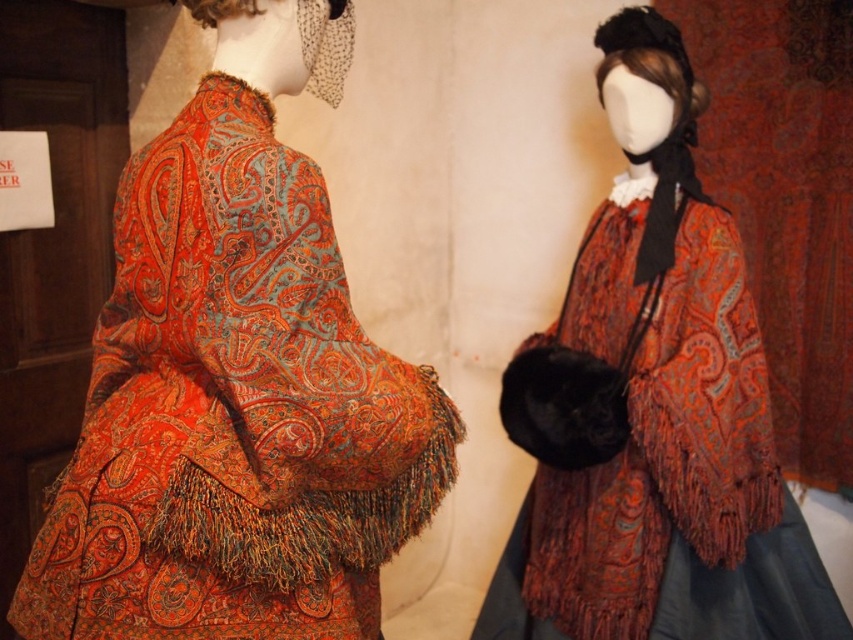
Question: Is paisley-patterned fabric at center below matte paisley cape at center?

Choices:
 (A) yes
 (B) no

Answer: (B)

Question: Can you confirm if paisley-patterned fabric at center is positioned above matte paisley cape at center?

Choices:
 (A) yes
 (B) no

Answer: (A)

Question: Can you confirm if paisley-patterned fabric at center is wider than matte paisley cape at center?

Choices:
 (A) yes
 (B) no

Answer: (B)

Question: Among these objects, which one is farthest from the camera?

Choices:
 (A) matte paisley cape at center
 (B) paisley-patterned fabric at center

Answer: (A)